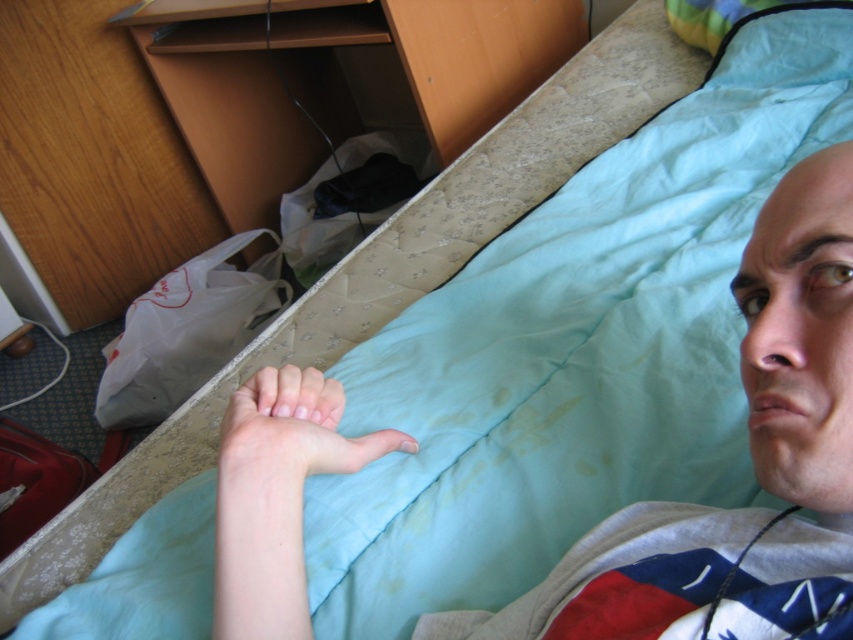
Is pale skin at lower center below pale skin hand at lower center?

Correct, pale skin at lower center is located below pale skin hand at lower center.

Between point (242, 561) and point (318, 426), which one is positioned behind?

Positioned behind is point (318, 426).

Locate an element on the screen. pale skin at lower center is located at coordinates (276, 496).